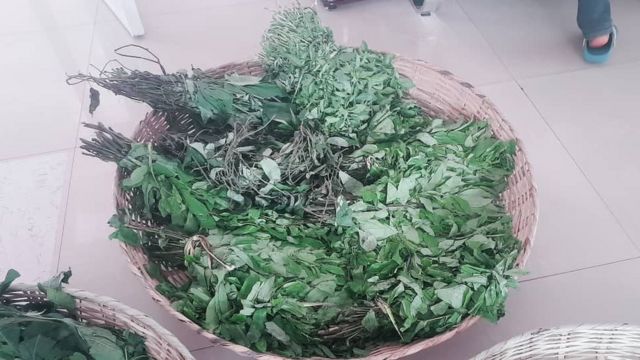
I want to click on baskets, so pyautogui.click(x=516, y=193), pyautogui.click(x=564, y=335), pyautogui.click(x=159, y=351).